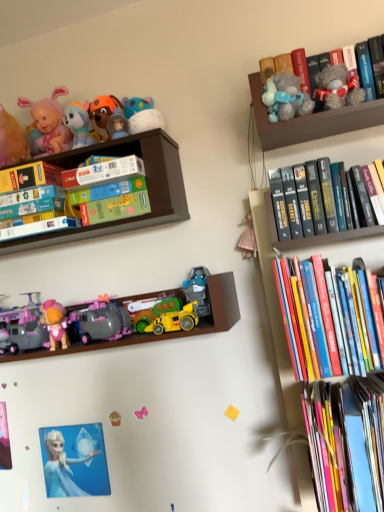
Question: Is wooden toy box at upper left, acting as the first shelf starting from the top, to the left of fluffy gray teddy bear at upper right, which is the 2th toy from top to bottom, from the viewer's perspective?

Choices:
 (A) yes
 (B) no

Answer: (A)

Question: From the image's perspective, is wooden toy box at upper left, the 2th shelf in the bottom-to-top sequence, under fluffy gray teddy bear at upper right, the 6th toy ordered from the bottom?

Choices:
 (A) no
 (B) yes

Answer: (B)

Question: Is wooden toy box at upper left, acting as the first shelf starting from the top, aimed at fluffy gray teddy bear at upper right, the 6th toy ordered from the bottom?

Choices:
 (A) yes
 (B) no

Answer: (B)

Question: Considering the relative sizes of wooden toy box at upper left, acting as the first shelf starting from the top, and fluffy gray teddy bear at upper right, acting as the second toy starting from the right, in the image provided, is wooden toy box at upper left, acting as the first shelf starting from the top, taller than fluffy gray teddy bear at upper right, acting as the second toy starting from the right,?

Choices:
 (A) yes
 (B) no

Answer: (A)

Question: From a real-world perspective, is wooden toy box at upper left, acting as the first shelf starting from the top, positioned over fluffy gray teddy bear at upper right, which is the 2th toy from top to bottom, based on gravity?

Choices:
 (A) yes
 (B) no

Answer: (B)

Question: Considering the positions of point (59, 452) and point (331, 201), is point (59, 452) closer or farther from the camera than point (331, 201)?

Choices:
 (A) closer
 (B) farther

Answer: (B)

Question: Would you say white glossy elsa at lower left is to the left or to the right of hardcover books at upper right, which ranks as the 3th book in bottom-to-top order, in the picture?

Choices:
 (A) left
 (B) right

Answer: (A)

Question: From the image's perspective, relative to hardcover books at upper right, the 1th book from the top, is white glossy elsa at lower left above or below?

Choices:
 (A) below
 (B) above

Answer: (A)

Question: Looking at the image, does white glossy elsa at lower left seem bigger or smaller compared to hardcover books at upper right, which ranks as the 3th book in bottom-to-top order?

Choices:
 (A) small
 (B) big

Answer: (A)

Question: Which is correct: pink fabric doll at lower left, which is the first toy in bottom-to-top order, is inside white matte paperback book at upper center, the second paperback book in the bottom-to-top sequence, or outside of it?

Choices:
 (A) inside
 (B) outside

Answer: (B)

Question: Based on their sizes in the image, would you say pink fabric doll at lower left, the 7th toy positioned from the top, is bigger or smaller than white matte paperback book at upper center, the second paperback book in the bottom-to-top sequence?

Choices:
 (A) small
 (B) big

Answer: (A)

Question: Is pink fabric doll at lower left, which is the first toy in bottom-to-top order, wider or thinner than white matte paperback book at upper center, the second paperback book in the bottom-to-top sequence?

Choices:
 (A) wide
 (B) thin

Answer: (B)

Question: Relative to white matte paperback book at upper center, the 1th paperback book from the right, is pink fabric doll at lower left, which appears as the fourth toy when viewed from the right, in front or behind?

Choices:
 (A) front
 (B) behind

Answer: (B)

Question: From a real-world perspective, relative to hardcover books at upper right, which ranks as the 3th book in bottom-to-top order, is matte purple plastic toy car at lower left, placed as the 1th toy when sorted from left to right, vertically above or below?

Choices:
 (A) below
 (B) above

Answer: (A)

Question: From the image's perspective, is matte purple plastic toy car at lower left, which appears as the 5th toy when viewed from the top, positioned above or below hardcover books at upper right, the 1th book from the top?

Choices:
 (A) above
 (B) below

Answer: (B)